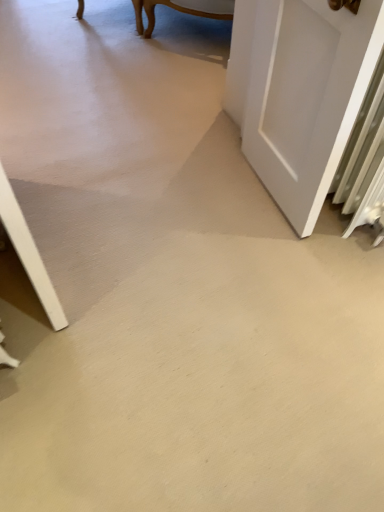
Describe the element at coordinates (302, 93) in the screenshot. I see `white matte door at right` at that location.

This screenshot has height=512, width=384. In order to click on white matte door at right in this screenshot , I will do `click(302, 93)`.

The image size is (384, 512). What are the coordinates of `smooth concrete floor at center` in the screenshot? It's located at (204, 383).

The image size is (384, 512). What do you see at coordinates (204, 383) in the screenshot? I see `smooth concrete floor at center` at bounding box center [204, 383].

Where is `white matte door at right`? white matte door at right is located at coordinates (302, 93).

Visually, is white matte door at right positioned to the left or to the right of smooth concrete floor at center?

From the image, it's evident that white matte door at right is to the right of smooth concrete floor at center.

Is white matte door at right in front of or behind smooth concrete floor at center in the image?

white matte door at right is positioned farther from the viewer than smooth concrete floor at center.

Which is closer to the camera, [259,31] or [233,357]?

Point [259,31] is positioned farther from the camera compared to point [233,357].

From the image's perspective, is white matte door at right above smooth concrete floor at center?

Yes.

From a real-world perspective, is white matte door at right above or below smooth concrete floor at center?

From a real-world perspective, white matte door at right is physically above smooth concrete floor at center.

Can you confirm if white matte door at right is wider than smooth concrete floor at center?

Incorrect, the width of white matte door at right does not surpass that of smooth concrete floor at center.

Which of these two, white matte door at right or smooth concrete floor at center, stands taller?

white matte door at right is taller.

Who is smaller, white matte door at right or smooth concrete floor at center?

white matte door at right.

Looking at this image, is white matte door at right surrounding smooth concrete floor at center?

No.

Are white matte door at right and smooth concrete floor at center far apart?

white matte door at right is actually quite close to smooth concrete floor at center.

Is white matte door at right positioned with its back to smooth concrete floor at center?

white matte door at right is not turned away from smooth concrete floor at center.

How many degrees apart are the facing directions of white matte door at right and smooth concrete floor at center?

white matte door at right and smooth concrete floor at center are facing 88 degrees away from each other.

How far apart are white matte door at right and smooth concrete floor at center?

A distance of 26.00 inches exists between white matte door at right and smooth concrete floor at center.

Identify the location of door that appears on the right of smooth concrete floor at center. This screenshot has height=512, width=384. (302, 93).

Considering the positions of objects smooth concrete floor at center and white matte door at right in the image provided, who is more to the right, smooth concrete floor at center or white matte door at right?

white matte door at right.

Which object is more forward, smooth concrete floor at center or white matte door at right?

smooth concrete floor at center is closer to the camera.

Is point (247, 261) behind point (298, 47)?

Yes, it is.

From the image's perspective, would you say smooth concrete floor at center is shown under white matte door at right?

Yes, from the image's perspective, smooth concrete floor at center is below white matte door at right.

From a real-world perspective, is smooth concrete floor at center positioned over white matte door at right based on gravity?

No, from a real-world perspective, smooth concrete floor at center is not on top of white matte door at right.

Is smooth concrete floor at center wider or thinner than white matte door at right?

smooth concrete floor at center is wider than white matte door at right.

Can you confirm if smooth concrete floor at center is taller than white matte door at right?

Incorrect, the height of smooth concrete floor at center is not larger of that of white matte door at right.

Looking at this image, is smooth concrete floor at center bigger than white matte door at right?

Yes.

Choose the correct answer: Is smooth concrete floor at center inside white matte door at right or outside it?

smooth concrete floor at center is spatially situated outside white matte door at right.

Is smooth concrete floor at center next to white matte door at right and touching it?

They are not placed beside each other.

Is smooth concrete floor at center looking in the opposite direction of white matte door at right?

No, smooth concrete floor at center's orientation is not away from white matte door at right.

Identify the location of door above the smooth concrete floor at center (from a real-world perspective). This screenshot has width=384, height=512. (302, 93).

Find the location of a particular element. The width and height of the screenshot is (384, 512). door located on the right of smooth concrete floor at center is located at coordinates (302, 93).

Where is `concrete located underneath the white matte door at right (from a real-world perspective)`? This screenshot has width=384, height=512. concrete located underneath the white matte door at right (from a real-world perspective) is located at coordinates (204, 383).